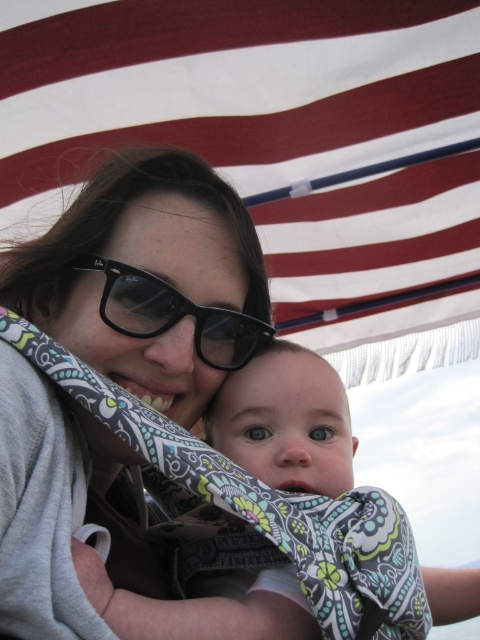
Question: Which point is farther to the camera?

Choices:
 (A) (457, 205)
 (B) (216, 301)
 (C) (120, 305)

Answer: (A)

Question: Does matte black sunglasses at center have a greater width compared to black plastic glasses at center?

Choices:
 (A) no
 (B) yes

Answer: (B)

Question: Which of the following is the closest to the observer?

Choices:
 (A) white striped fabric at upper center
 (B) matte black sunglasses at center

Answer: (B)

Question: Does white striped fabric at upper center appear under black plastic glasses at center?

Choices:
 (A) yes
 (B) no

Answer: (B)

Question: Which object appears farthest from the camera in this image?

Choices:
 (A) matte black sunglasses at center
 (B) black plastic glasses at center

Answer: (B)

Question: In this image, where is white striped fabric at upper center located relative to black plastic glasses at center?

Choices:
 (A) right
 (B) left

Answer: (A)